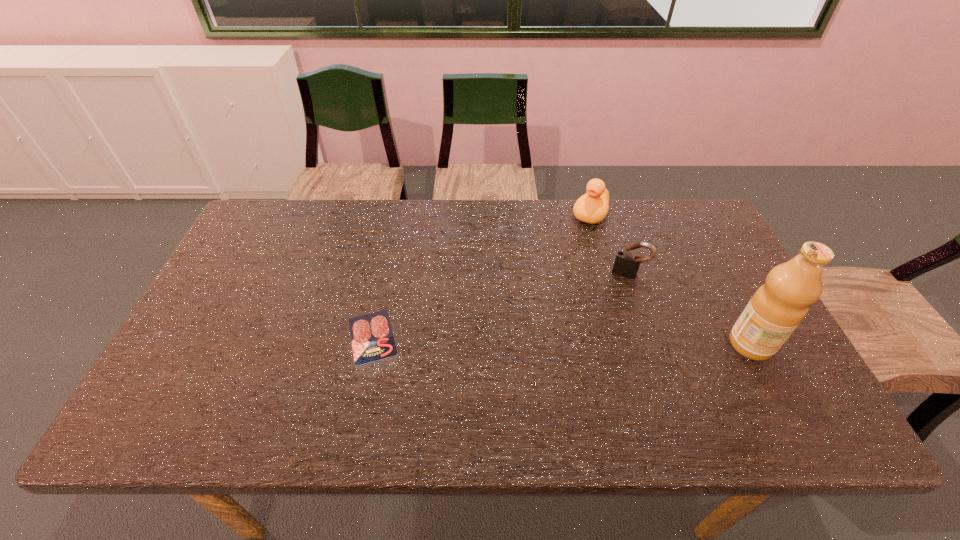
Where is `vacant area situated on the face of the farthest object`? vacant area situated on the face of the farthest object is located at coordinates (536, 306).

What are the coordinates of `free location located on the face of the farthest object` in the screenshot? It's located at (546, 289).

In order to click on vacant position located on the face of the farthest object in this screenshot , I will do tap(567, 255).

Find the location of a particular element. object that is at the far edge is located at coordinates [592, 207].

You are a GUI agent. You are given a task and a screenshot of the screen. Output one action in this format:
    pyautogui.click(x=<x>, y=<y>)
    Task: Click on the object located in the near edge section of the desktop
    The image size is (960, 540).
    Given the screenshot: What is the action you would take?
    pyautogui.click(x=372, y=339)

Image resolution: width=960 pixels, height=540 pixels. In order to click on object that is at the right edge in this screenshot , I will do `click(775, 310)`.

Find the location of `free spot at the far edge of the desktop`. free spot at the far edge of the desktop is located at coordinates (523, 207).

Image resolution: width=960 pixels, height=540 pixels. In the image, there is a desktop. In order to click on free region at the near edge in this screenshot , I will do `click(590, 368)`.

In the image, there is a desktop. At what (x,y) coordinates should I click in order to perform the action: click on vacant space at the left edge. Please return your answer as a coordinate pair (x, y). The image size is (960, 540). Looking at the image, I should click on (185, 346).

Locate an element on the screen. vacant position at the right edge of the desktop is located at coordinates (711, 319).